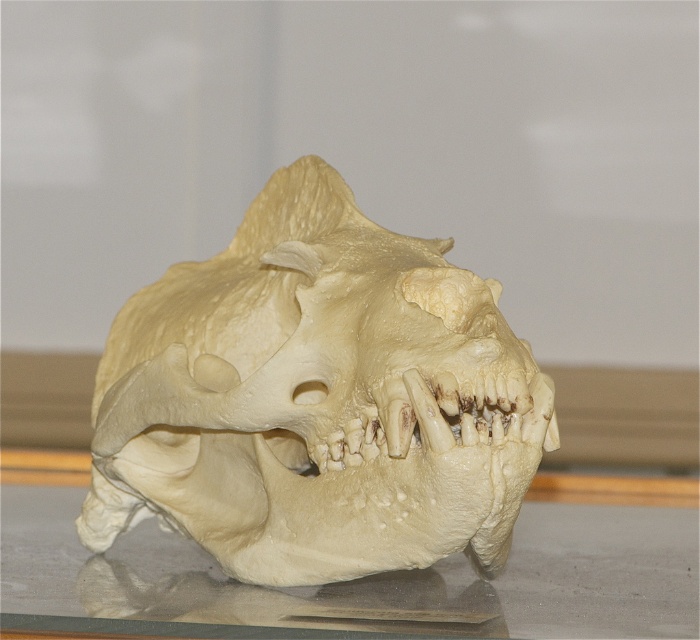
Based on the photo, is white matte skull at center positioned behind translucent glass table at lower center?

Yes, it is.

Locate an element on the screen. white matte skull at center is located at coordinates (316, 400).

This screenshot has height=640, width=700. In order to click on white matte skull at center in this screenshot , I will do `click(316, 400)`.

Locate an element on the screen. Image resolution: width=700 pixels, height=640 pixels. white matte skull at center is located at coordinates (316, 400).